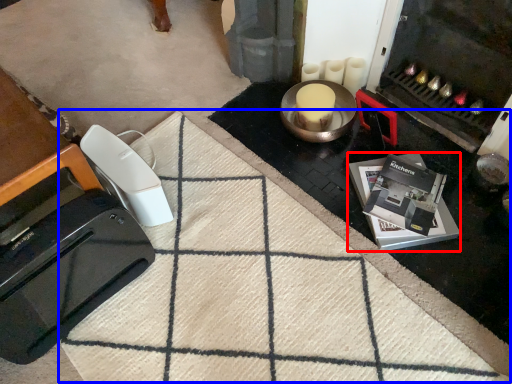
Question: Among these objects, which one is farthest to the camera, appliance (highlighted by a red box) or doormat (highlighted by a blue box)?

Choices:
 (A) appliance
 (B) doormat

Answer: (A)